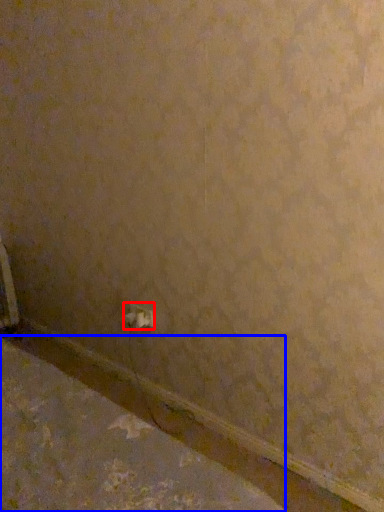
Question: Which object appears closest to the camera in this image, power plugs and sockets (highlighted by a red box) or concrete (highlighted by a blue box)?

Choices:
 (A) power plugs and sockets
 (B) concrete

Answer: (B)